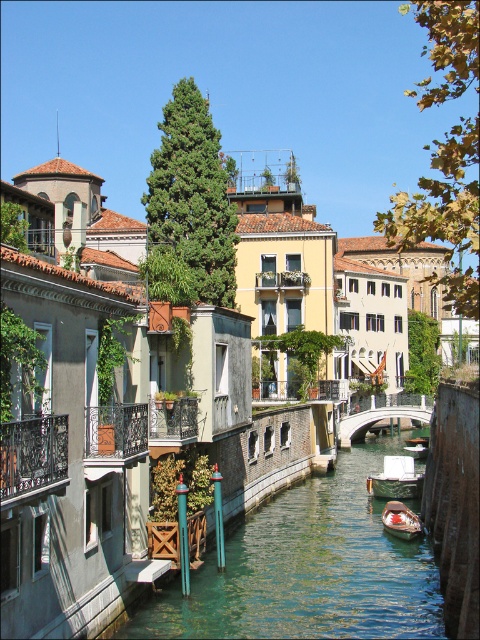
Question: Is the position of greenish water at center less distant than that of green wooden boat at center?

Choices:
 (A) no
 (B) yes

Answer: (B)

Question: Where is greenish water at center located in relation to green wooden boat at center in the image?

Choices:
 (A) left
 (B) right

Answer: (A)

Question: Does white stone bridge at center have a lesser width compared to green wooden boat at center?

Choices:
 (A) yes
 (B) no

Answer: (B)

Question: Which object appears closest to the camera in this image?

Choices:
 (A) wooden boat at center
 (B) green wooden boat at center
 (C) white stone bridge at center
 (D) greenish water at center

Answer: (D)

Question: Among these objects, which one is nearest to the camera?

Choices:
 (A) greenish water at center
 (B) white stone bridge at center
 (C) wooden boat at center
 (D) green wooden boat at center

Answer: (A)

Question: Considering the real-world distances, which object is closest to the wooden boat at center?

Choices:
 (A) green wooden boat at center
 (B) greenish water at center
 (C) white stone bridge at center

Answer: (B)